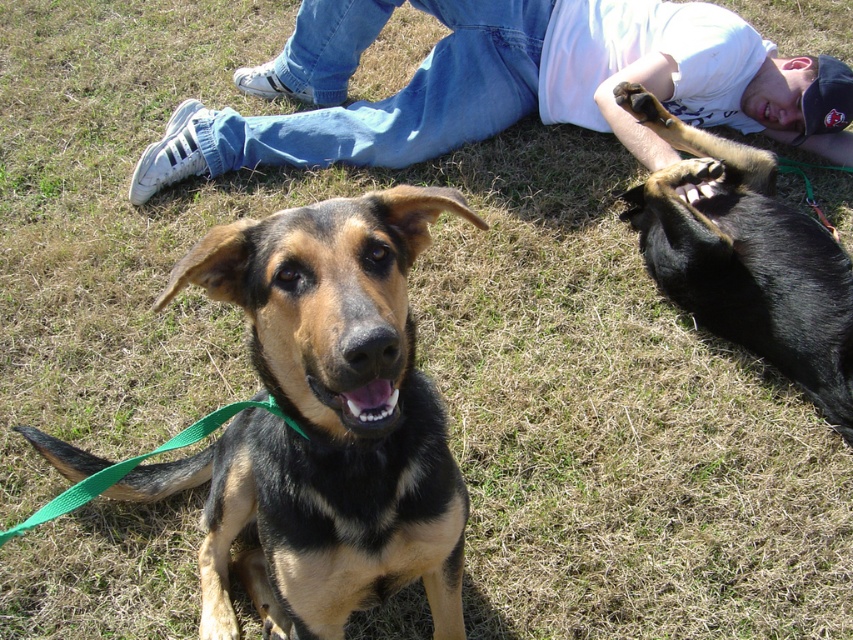
You are a photographer trying to capture a photo of the black and tan fur dog at center and the jeans at center. Based on their positions, which one is closer to the camera?

The black and tan fur dog at center is closer to the camera because it is positioned below the jeans at center, indicating it is in front of the jeans.

You are a photographer setting up a tripod to capture both the black and tan fur dog at center and the black glossy dog at upper right in the same frame. Based on their heights, which dog will appear larger in the photo?

The black and tan fur dog at center is shorter than the black glossy dog at upper right, so the black glossy dog at upper right will appear larger in the photo if they are positioned at the same distance from the camera.

You are a photographer trying to capture both dogs in the scene. Since the black and tan fur dog at center is below the black glossy dog at upper right, will you need to adjust your camera angle to include both dogs in the frame?

Yes, you will need to adjust your camera angle to include both the black and tan fur dog at center and the black glossy dog at upper right since the black and tan fur dog at center is located below the black glossy dog at upper right.